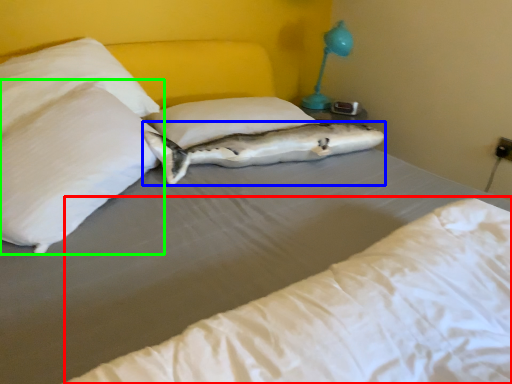
Question: Estimate the real-world distances between objects in this image. Which object is closer to mattress (highlighted by a red box), fish (highlighted by a blue box) or pillow (highlighted by a green box)?

Choices:
 (A) fish
 (B) pillow

Answer: (B)